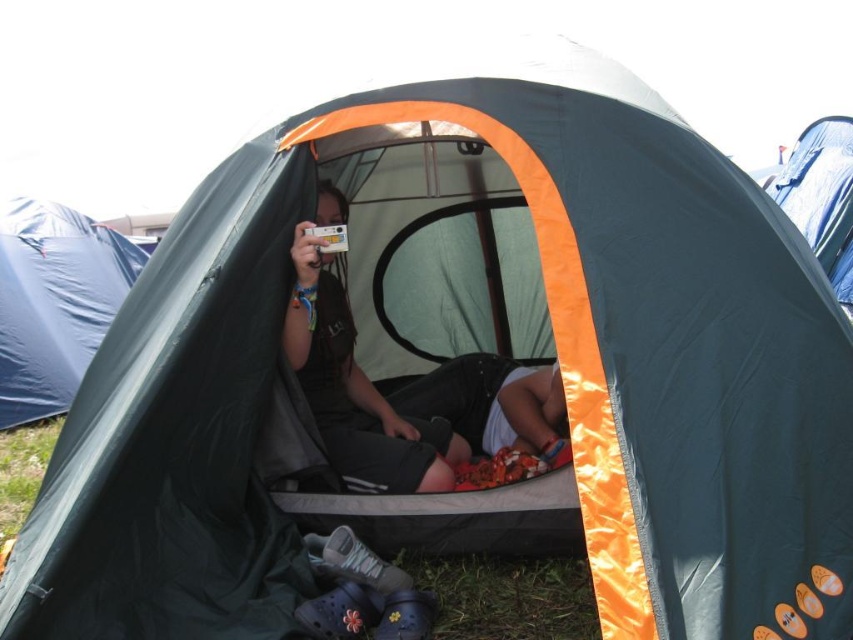
Question: Can you confirm if matte black shorts at center is thinner than blue tarpaulin tent at left?

Choices:
 (A) no
 (B) yes

Answer: (A)

Question: Which point appears farthest from the camera in this image?

Choices:
 (A) (62, 305)
 (B) (834, 115)

Answer: (B)

Question: Estimate the real-world distances between objects in this image. Which object is closer to the blue tarpaulin tent at left?

Choices:
 (A) blue tarpaulin tent at upper right
 (B) matte black shorts at center

Answer: (B)

Question: Is matte black shorts at center closer to the viewer compared to blue tarpaulin tent at left?

Choices:
 (A) yes
 (B) no

Answer: (A)

Question: Does matte black shorts at center lie in front of blue tarpaulin tent at left?

Choices:
 (A) yes
 (B) no

Answer: (A)

Question: Estimate the real-world distances between objects in this image. Which object is farther from the matte black shorts at center?

Choices:
 (A) blue tarpaulin tent at upper right
 (B) blue tarpaulin tent at left

Answer: (A)